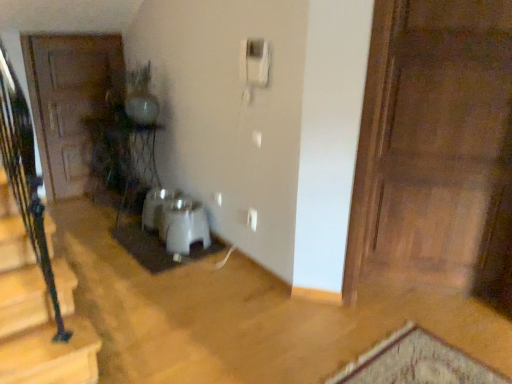
Question: In terms of width, does white plastic water heater at center look wider or thinner when compared to white plastic corded phone at upper center?

Choices:
 (A) wide
 (B) thin

Answer: (A)

Question: Is white plastic water heater at center bigger or smaller than white plastic corded phone at upper center?

Choices:
 (A) big
 (B) small

Answer: (A)

Question: Estimate the real-world distances between objects in this image. Which object is closer to the white plastic water heater at center?

Choices:
 (A) wooden door at left, which ranks as the first door in left-to-right order
 (B) wooden door at right, which ranks as the 1th door in front-to-back order
 (C) white plastic corded phone at upper center
 (D) white matte doormat at center

Answer: (D)

Question: Estimate the real-world distances between objects in this image. Which object is closer to the white matte doormat at center?

Choices:
 (A) white plastic water heater at center
 (B) wooden door at left, which ranks as the first door in back-to-front order
 (C) white plastic corded phone at upper center
 (D) wooden door at right, which ranks as the 1th door in front-to-back order

Answer: (A)